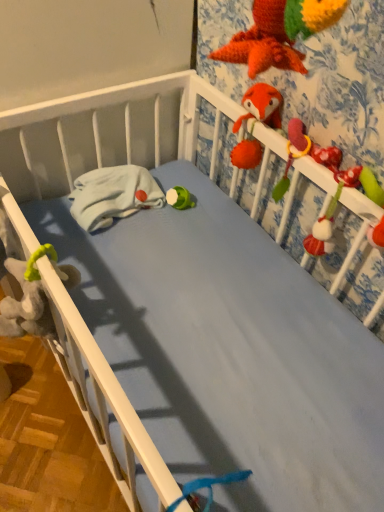
Question: In terms of height, does fuzzy red parrot at upper right look taller or shorter compared to white matte crib rail at center?

Choices:
 (A) tall
 (B) short

Answer: (A)

Question: Which is correct: fuzzy red parrot at upper right is inside white matte crib rail at center, or outside of it?

Choices:
 (A) inside
 (B) outside

Answer: (B)

Question: Based on their relative distances, which object is nearer to the fuzzy red parrot at upper right?

Choices:
 (A) fluffy orange fox at upper right, the 1th toy viewed from the left
 (B) white matte crib rail at center
 (C) soft plush toy at right, which is the first toy in right-to-left order

Answer: (C)

Question: Which is nearer to the fuzzy red parrot at upper right?

Choices:
 (A) fluffy orange fox at upper right, the 1th toy viewed from the left
 (B) white matte crib rail at center
 (C) soft plush toy at right, which is the first toy in right-to-left order

Answer: (C)